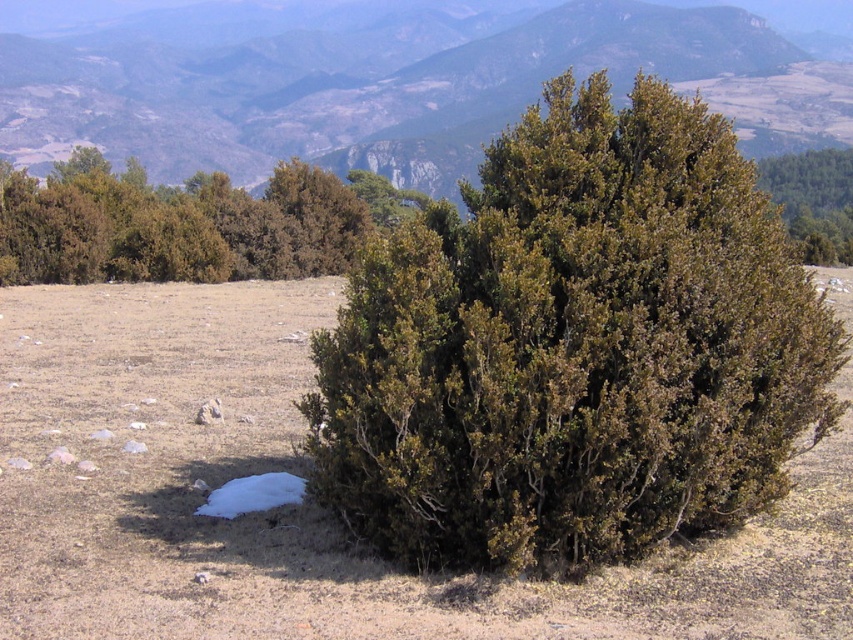
Can you confirm if green leafy shrub at center is positioned above brown dry grass at center?

Correct, green leafy shrub at center is located above brown dry grass at center.

Who is positioned more to the right, green leafy shrub at center or brown dry grass at center?

Positioned to the right is green leafy shrub at center.

Where is `green leafy shrub at center`? The width and height of the screenshot is (853, 640). green leafy shrub at center is located at coordinates (573, 348).

Between point (318, 240) and point (776, 196), which one is positioned in front?

Point (318, 240) is in front.

I want to click on green leafy bush at upper left, so click(x=173, y=225).

Between point (265, 220) and point (804, 189), which one is positioned in front?

Point (265, 220) is in front.

Find the location of a particular element. The image size is (853, 640). green leafy bush at upper left is located at coordinates (173, 225).

Consider the image. Is brown dry grass at center to the right of green leafy bush at center from the viewer's perspective?

Indeed, brown dry grass at center is positioned on the right side of green leafy bush at center.

Is brown dry grass at center to the left of green leafy bush at center from the viewer's perspective?

In fact, brown dry grass at center is to the right of green leafy bush at center.

Which is in front, point (13, 540) or point (518, 29)?

Point (13, 540) is in front.

Where is `brown dry grass at center`? brown dry grass at center is located at coordinates (305, 504).